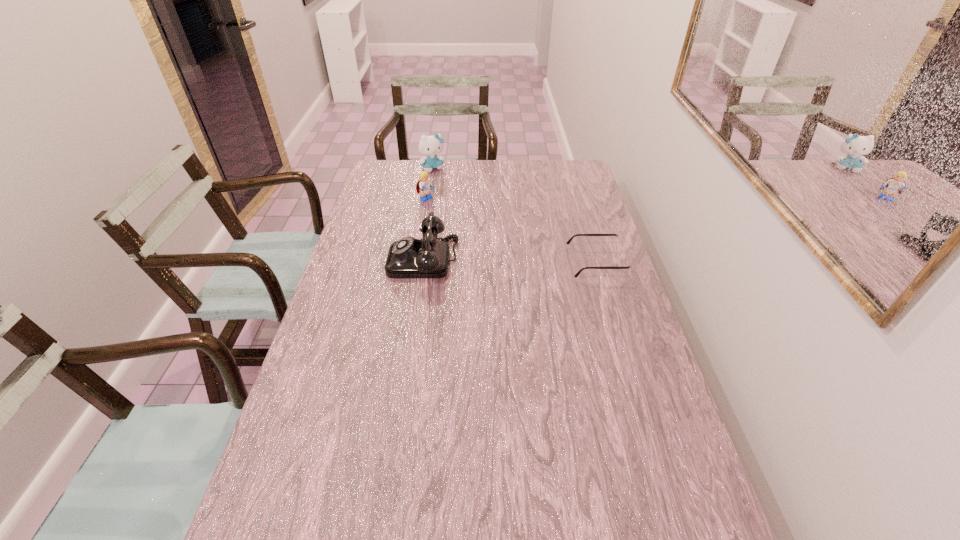
Find the location of a particular element. The height and width of the screenshot is (540, 960). telephone is located at coordinates (409, 257).

This screenshot has width=960, height=540. I want to click on the rightmost object, so click(x=619, y=244).

You are a GUI agent. You are given a task and a screenshot of the screen. Output one action in this format:
    pyautogui.click(x=<x>, y=<y>)
    Task: Click on the shortest object
    Image resolution: width=960 pixels, height=540 pixels.
    Given the screenshot: What is the action you would take?
    pyautogui.click(x=619, y=244)

Where is `the second farthest object`? The width and height of the screenshot is (960, 540). the second farthest object is located at coordinates 424,186.

The height and width of the screenshot is (540, 960). In order to click on the farthest object in this screenshot , I will do `click(430, 146)`.

Locate an element on the screen. Image resolution: width=960 pixels, height=540 pixels. free point located 0.100m on the dial of the telephone is located at coordinates tap(358, 260).

At what (x,y) coordinates should I click in order to perform the action: click on free location located on the dial of the telephone. Please return your answer as a coordinate pair (x, y). The image size is (960, 540). Looking at the image, I should click on (343, 260).

Identify the location of vacant space located on the dial of the telephone. The height and width of the screenshot is (540, 960). (343, 260).

You are a GUI agent. You are given a task and a screenshot of the screen. Output one action in this format:
    pyautogui.click(x=<x>, y=<y>)
    Task: Click on the vacant space situated on the front-facing side of the third nearest object
    Image resolution: width=960 pixels, height=540 pixels.
    Given the screenshot: What is the action you would take?
    pyautogui.click(x=485, y=238)

Find the location of a particular element. This screenshot has width=960, height=540. blank area located on the front-facing side of the third nearest object is located at coordinates pyautogui.click(x=444, y=212).